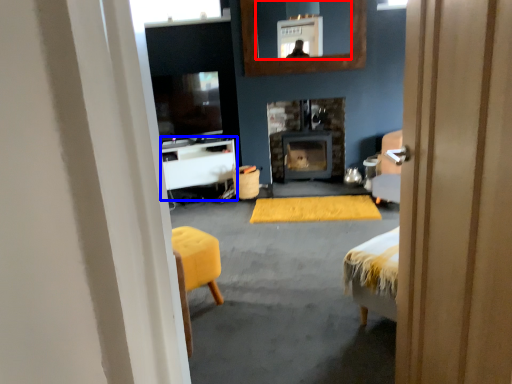
Question: Which point is further to the camera, mirror (highlighted by a red box) or table (highlighted by a blue box)?

Choices:
 (A) mirror
 (B) table

Answer: (B)